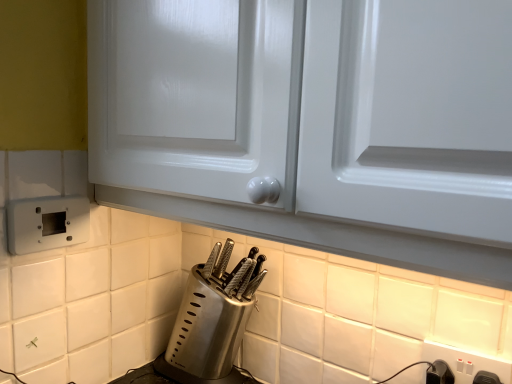
Question: Does black plastic switch at lower right contain white plastic electric outlet at lower left, the 1th electric outlet when ordered from top to bottom?

Choices:
 (A) yes
 (B) no

Answer: (B)

Question: From the image's perspective, is black plastic switch at lower right above white plastic electric outlet at lower left, the second electric outlet when ordered from bottom to top?

Choices:
 (A) no
 (B) yes

Answer: (A)

Question: Is black plastic switch at lower right taller than white plastic electric outlet at lower left, the second electric outlet when ordered from bottom to top?

Choices:
 (A) yes
 (B) no

Answer: (B)

Question: Is black plastic switch at lower right shorter than white plastic electric outlet at lower left, the second electric outlet when ordered from bottom to top?

Choices:
 (A) no
 (B) yes

Answer: (B)

Question: Is black plastic switch at lower right positioned with its back to white plastic electric outlet at lower left, the 1th electric outlet when ordered from top to bottom?

Choices:
 (A) no
 (B) yes

Answer: (A)

Question: Considering the relative positions of black plastic switch at lower right and white plastic electric outlet at lower left, the 1th electric outlet when ordered from top to bottom, in the image provided, is black plastic switch at lower right behind white plastic electric outlet at lower left, the 1th electric outlet when ordered from top to bottom,?

Choices:
 (A) no
 (B) yes

Answer: (A)

Question: Considering the relative positions of black plastic switch at lower right and white plastic electric outlet at lower right, the first electric outlet ordered from the bottom, in the image provided, is black plastic switch at lower right to the left of white plastic electric outlet at lower right, the first electric outlet ordered from the bottom, from the viewer's perspective?

Choices:
 (A) no
 (B) yes

Answer: (B)

Question: Is black plastic switch at lower right with white plastic electric outlet at lower right, acting as the 2th electric outlet starting from the left?

Choices:
 (A) yes
 (B) no

Answer: (A)

Question: From a real-world perspective, is black plastic switch at lower right physically above white plastic electric outlet at lower right, which ranks as the second electric outlet in top-to-bottom order?

Choices:
 (A) yes
 (B) no

Answer: (B)

Question: Does black plastic switch at lower right turn towards white plastic electric outlet at lower right, the first electric outlet ordered from the bottom?

Choices:
 (A) no
 (B) yes

Answer: (A)

Question: Is black plastic switch at lower right shorter than white plastic electric outlet at lower right, placed as the first electric outlet when sorted from right to left?

Choices:
 (A) yes
 (B) no

Answer: (A)

Question: Is black plastic switch at lower right wider than white plastic electric outlet at lower right, which ranks as the second electric outlet in top-to-bottom order?

Choices:
 (A) no
 (B) yes

Answer: (B)

Question: Does white plastic electric outlet at lower right, placed as the first electric outlet when sorted from right to left, have a lesser width compared to satin silver knife block at lower center?

Choices:
 (A) yes
 (B) no

Answer: (A)